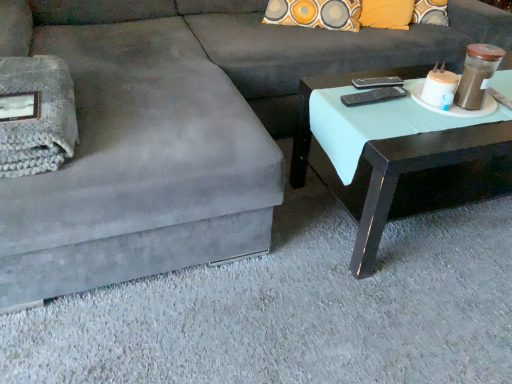
Locate an element on the screen. vacant space to the right of black plastic remote at upper right, the 2th remote viewed from the back is located at coordinates (422, 111).